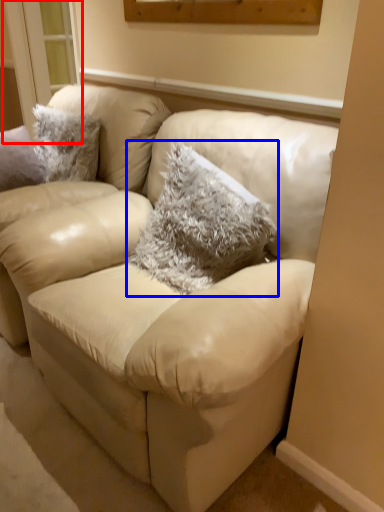
Question: Which object is closer to the camera taking this photo, window (highlighted by a red box) or throw pillow (highlighted by a blue box)?

Choices:
 (A) window
 (B) throw pillow

Answer: (B)